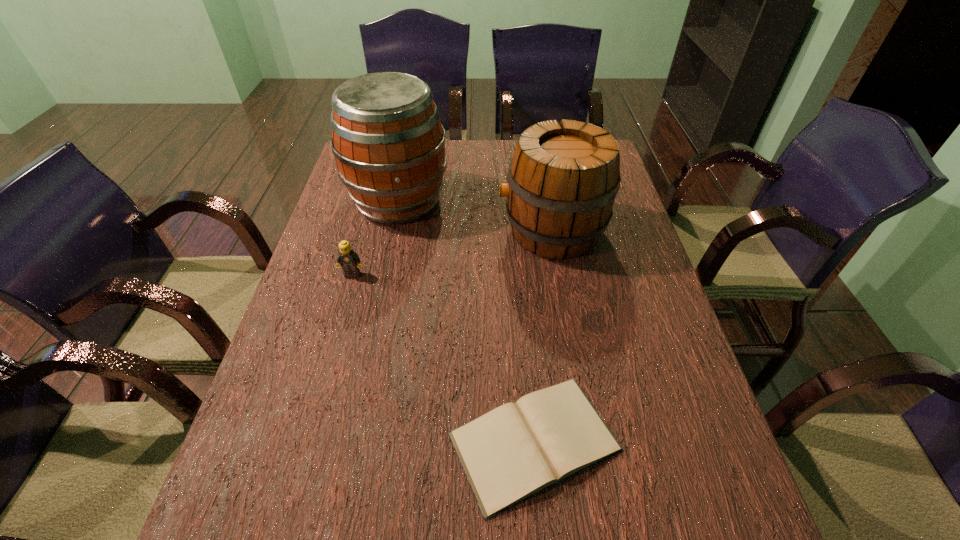
The image size is (960, 540). I want to click on free space located 0.050m on the side of the third shortest object where the spigot is located, so click(x=481, y=231).

Identify the location of vacant area situated 0.270m on the side of the third shortest object where the spigot is located. (405, 231).

Find the location of `free space located in front of the Lego`. free space located in front of the Lego is located at coordinates (334, 341).

At what (x,y) coordinates should I click in order to perform the action: click on free region located 0.280m on the left of the nearest object. Please return your answer as a coordinate pair (x, y). The image size is (960, 540). Looking at the image, I should click on (301, 441).

Where is `object that is at the far edge`? The image size is (960, 540). object that is at the far edge is located at coordinates (389, 145).

The height and width of the screenshot is (540, 960). Identify the location of cider that is at the left edge. (389, 145).

You are a GUI agent. You are given a task and a screenshot of the screen. Output one action in this format:
    pyautogui.click(x=<x>, y=<y>)
    Task: Click on the Lego that is at the left edge
    Image resolution: width=960 pixels, height=540 pixels.
    Given the screenshot: What is the action you would take?
    pyautogui.click(x=349, y=260)

Locate an element on the screen. This screenshot has width=960, height=540. object located at the right edge is located at coordinates (563, 178).

This screenshot has width=960, height=540. I want to click on object present at the far left corner, so click(x=389, y=145).

The width and height of the screenshot is (960, 540). I want to click on vacant space at the left edge of the desktop, so click(x=278, y=420).